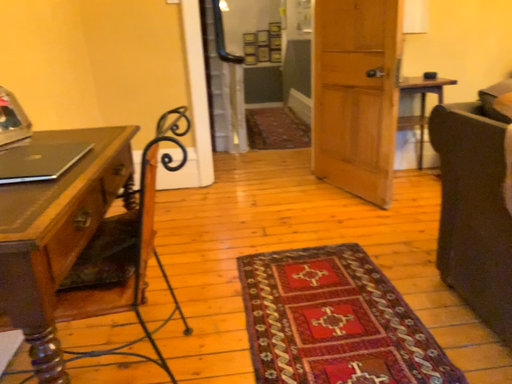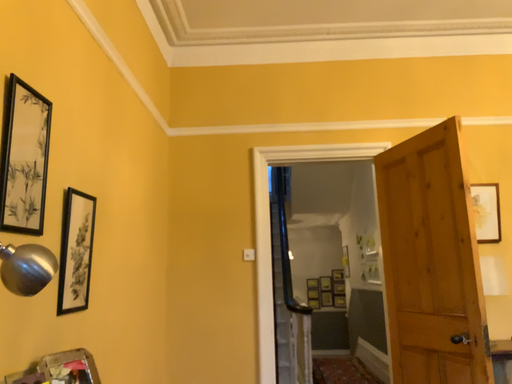
Question: How did the camera likely rotate when shooting the video?

Choices:
 (A) rotated left
 (B) rotated right

Answer: (A)